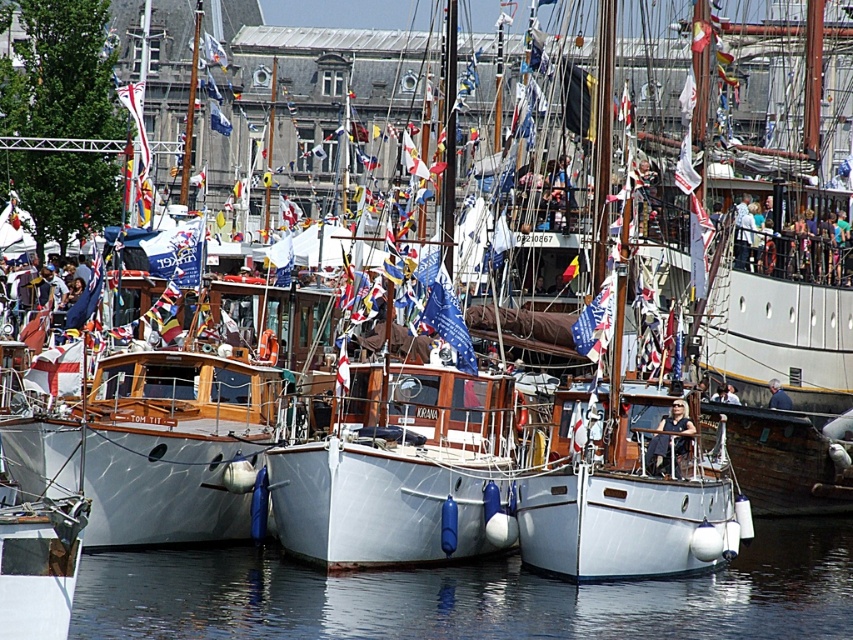
Question: From the image, what is the correct spatial relationship of transparent water at lower center in relation to white matte boat at center?

Choices:
 (A) left
 (B) right

Answer: (B)

Question: Is transparent water at lower center to the left of white matte boat at center from the viewer's perspective?

Choices:
 (A) no
 (B) yes

Answer: (A)

Question: Which point is farther to the camera?

Choices:
 (A) (369, 486)
 (B) (282, 588)

Answer: (B)

Question: Can you confirm if transparent water at lower center is positioned above white matte boat at center?

Choices:
 (A) yes
 (B) no

Answer: (B)